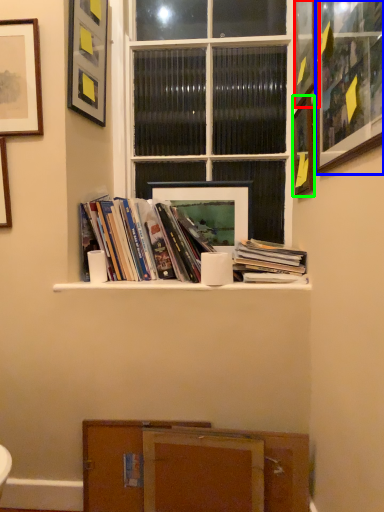
Question: Which object is the farthest from picture frame (highlighted by a red box)? Choose among these: picture frame (highlighted by a blue box) or picture frame (highlighted by a green box).

Choices:
 (A) picture frame
 (B) picture frame

Answer: (A)